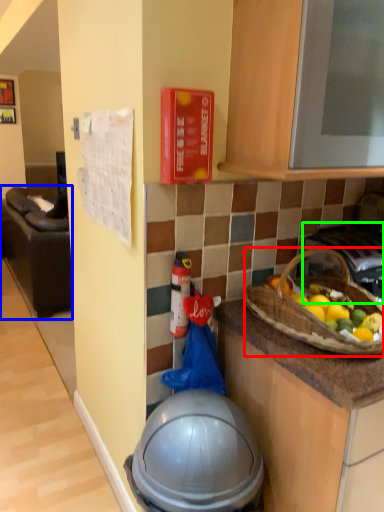
Question: Which object is positioned farthest from picnic basket (highlighted by a red box)? Select from furniture (highlighted by a blue box) and gas stove (highlighted by a green box).

Choices:
 (A) furniture
 (B) gas stove

Answer: (A)